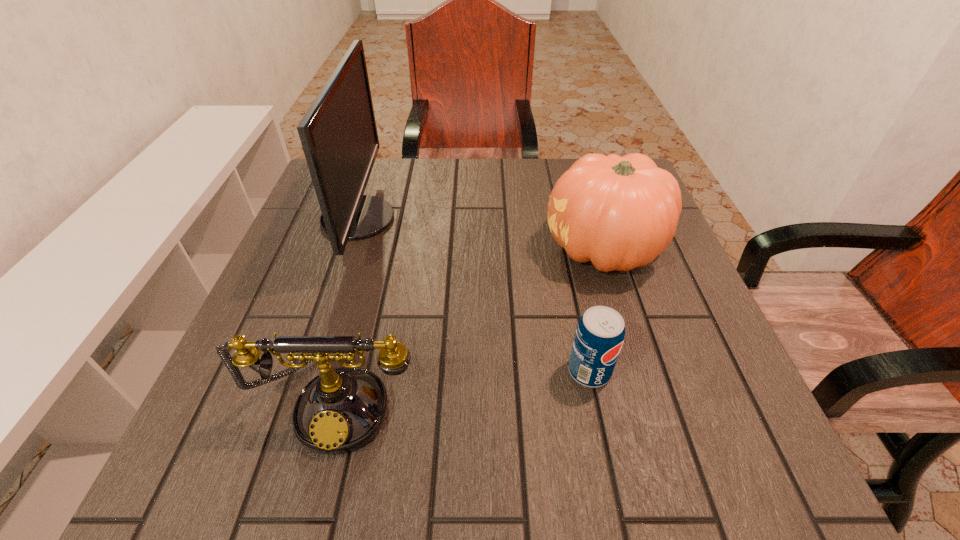
Where is `object positioned at the near edge`? This screenshot has height=540, width=960. object positioned at the near edge is located at coordinates (341, 410).

Where is `monitor present at the left edge`? The height and width of the screenshot is (540, 960). monitor present at the left edge is located at coordinates (338, 133).

The width and height of the screenshot is (960, 540). What are the coordinates of `telephone situated at the left edge` in the screenshot? It's located at pos(341,410).

Find the location of a particular element. object present at the right edge is located at coordinates (620, 213).

The image size is (960, 540). In order to click on object that is at the far left corner in this screenshot , I will do `click(338, 133)`.

Where is `object located at the near left corner`? The width and height of the screenshot is (960, 540). object located at the near left corner is located at coordinates click(x=341, y=410).

The image size is (960, 540). I want to click on blank area at the far edge, so click(526, 172).

Locate an element on the screen. The image size is (960, 540). vacant space at the near edge of the desktop is located at coordinates (510, 457).

In the image, there is a desktop. Where is `free space at the right edge`? free space at the right edge is located at coordinates click(687, 291).

What are the coordinates of `vacant space at the far left corner of the desktop` in the screenshot? It's located at (380, 173).